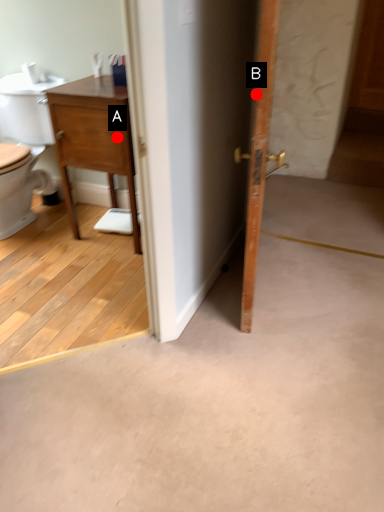
Question: Two points are circled on the image, labeled by A and B beside each circle. Which of the following is the closest to the observer?

Choices:
 (A) A is closer
 (B) B is closer

Answer: (B)